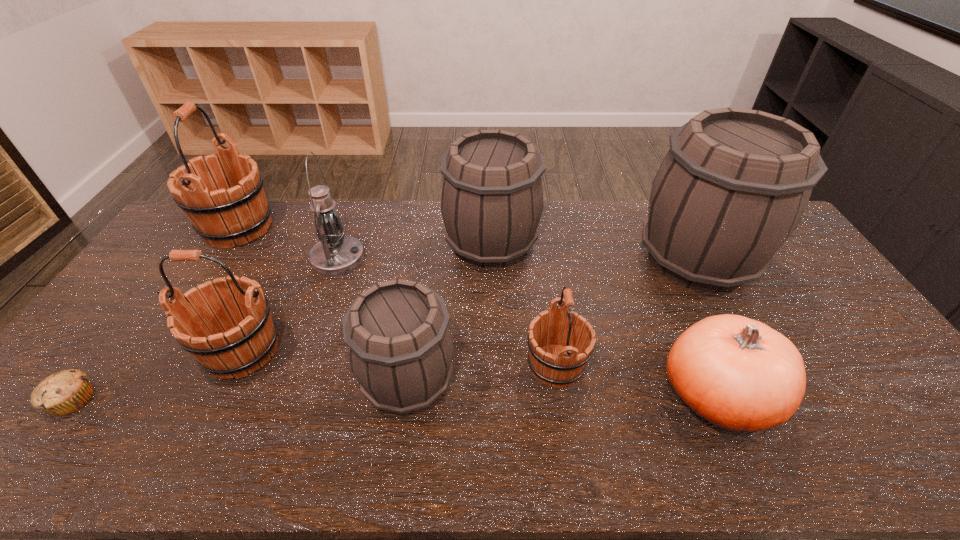
Image resolution: width=960 pixels, height=540 pixels. Identify the location of unoccupied position between the second smallest brown wine bucket and the oil lamp. (415, 252).

The image size is (960, 540). Find the location of `vacant area that lies between the farthest wood wine bucket and the orange pumpkin`. vacant area that lies between the farthest wood wine bucket and the orange pumpkin is located at coordinates (478, 312).

Where is `free space between the biggest wood wine bucket and the smallest brown wine bucket`? This screenshot has width=960, height=540. free space between the biggest wood wine bucket and the smallest brown wine bucket is located at coordinates (324, 304).

You are a GUI agent. You are given a task and a screenshot of the screen. Output one action in this format:
    pyautogui.click(x=<x>, y=<y>)
    Task: Click on the unoccupied area between the pumpkin and the biggest wood wine bucket
    
    Given the screenshot: What is the action you would take?
    [x=478, y=312]

You are a GUI agent. You are given a task and a screenshot of the screen. Output one action in this format:
    pyautogui.click(x=<x>, y=<y>)
    Task: Click on the vacant area that lies between the second biggest brown wine bucket and the rightmost brown wine bucket
    
    Given the screenshot: What is the action you would take?
    pyautogui.click(x=593, y=252)

Choose which object is the fifth nearest neighbor to the muffin. Please provide its 2D coordinates. Your answer should be formatted as a tuple, i.e. [(x, y)], where the tuple contains the x and y coordinates of a point satisfying the conditions above.

[(492, 196)]

Where is `object that is the sixth closest to the oil lamp`? object that is the sixth closest to the oil lamp is located at coordinates (551, 362).

The width and height of the screenshot is (960, 540). I want to click on wine bucket that is the fourth closest to the nearest brown wine bucket, so click(x=237, y=212).

At what (x,y) coordinates should I click in order to perform the action: click on wine bucket that is the fifth closest to the pumpkin. Please return your answer as a coordinate pair (x, y). Looking at the image, I should click on (233, 337).

Point out which wood wine bucket is positioned as the second nearest to the second smallest wood wine bucket. Please provide its 2D coordinates. Your answer should be formatted as a tuple, i.e. [(x, y)], where the tuple contains the x and y coordinates of a point satisfying the conditions above.

[(551, 362)]